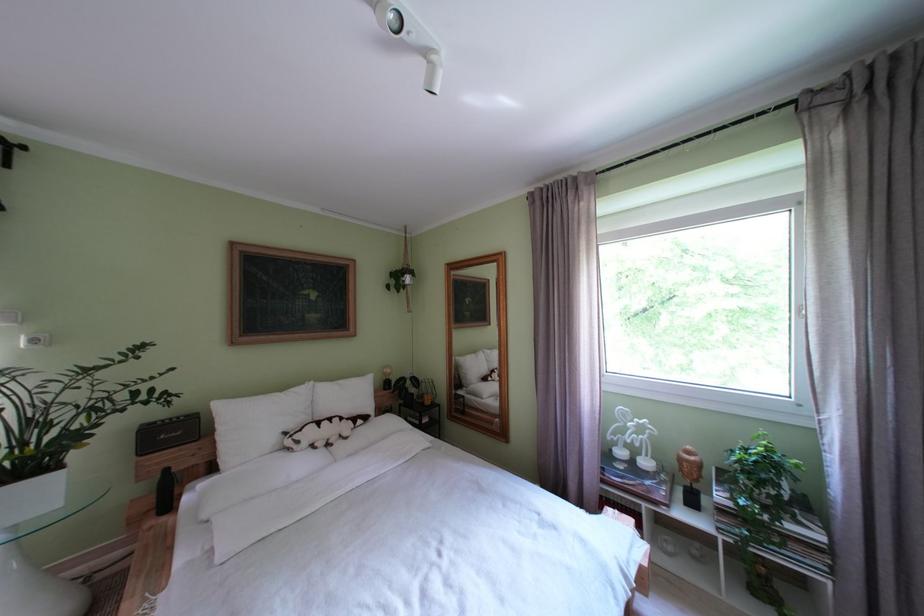
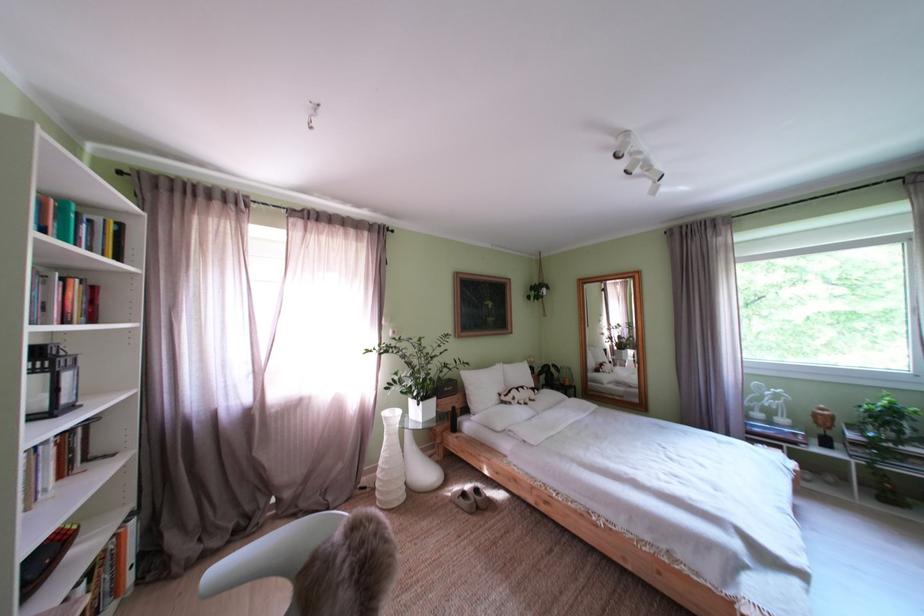
Find the pixel in the second image that matches (310,447) in the first image.

(525, 405)